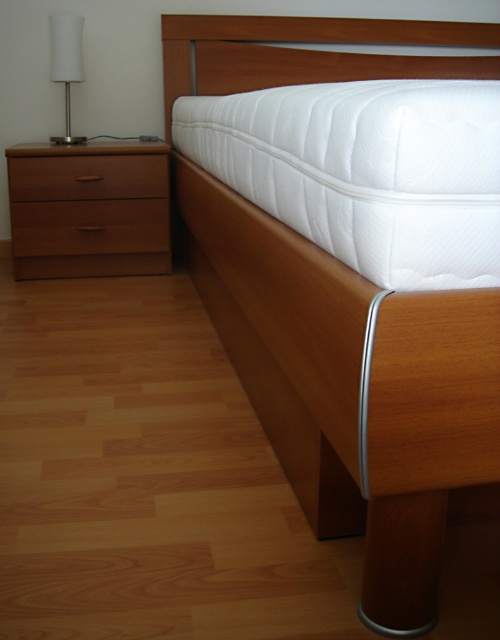
Does wooden headboard at upper center have a smaller size compared to white matte lamp at left?

Incorrect, wooden headboard at upper center is not smaller in size than white matte lamp at left.

Which is below, wooden headboard at upper center or white matte lamp at left?

white matte lamp at left is below.

The height and width of the screenshot is (640, 500). What do you see at coordinates (308, 52) in the screenshot? I see `wooden headboard at upper center` at bounding box center [308, 52].

Where is `wooden headboard at upper center`? This screenshot has height=640, width=500. wooden headboard at upper center is located at coordinates (308, 52).

Can you confirm if brown matte drawer at left is smaller than brown wood drawer at left?

No, brown matte drawer at left is not smaller than brown wood drawer at left.

Is brown matte drawer at left to the right of brown wood drawer at left from the viewer's perspective?

No, brown matte drawer at left is not to the right of brown wood drawer at left.

Locate an element on the screen. brown matte drawer at left is located at coordinates tap(90, 227).

Is light brown wood dresser at left taller than brown matte drawer at left?

Correct, light brown wood dresser at left is much taller as brown matte drawer at left.

Is point (166, 243) positioned before point (118, 244)?

No, it is behind (118, 244).

At what (x,y) coordinates should I click in order to perform the action: click on light brown wood dresser at left. Please return your answer as a coordinate pair (x, y). The width and height of the screenshot is (500, 640). Looking at the image, I should click on (89, 209).